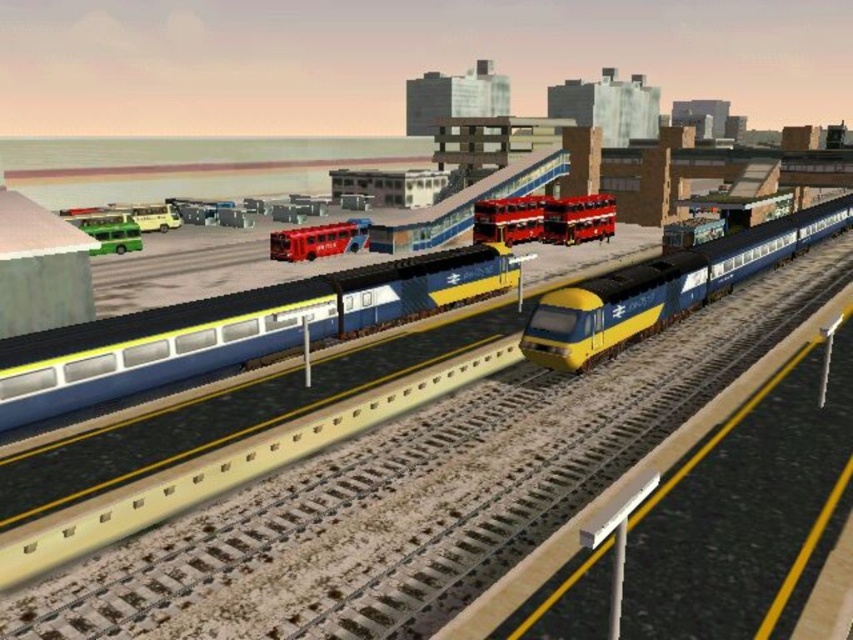
Does blue glossy train at center lie in front of red metallic bus at center?

Yes.

Is blue glossy train at center above red metallic bus at center?

Incorrect, blue glossy train at center is not positioned above red metallic bus at center.

What do you see at coordinates (231, 330) in the screenshot?
I see `blue glossy train at center` at bounding box center [231, 330].

At what (x,y) coordinates should I click in order to perform the action: click on blue glossy train at center. Please return your answer as a coordinate pair (x, y). Looking at the image, I should click on (231, 330).

How much distance is there between yellow matte passenger train at center and metallic red bus at center?

yellow matte passenger train at center and metallic red bus at center are 18.52 meters apart from each other.

What do you see at coordinates (666, 288) in the screenshot? I see `yellow matte passenger train at center` at bounding box center [666, 288].

Does point (727, 257) come in front of point (340, 221)?

That is True.

The width and height of the screenshot is (853, 640). I want to click on yellow matte passenger train at center, so click(666, 288).

Who is more forward, (129, 356) or (595, 310)?

Point (129, 356)

Can you confirm if blue glossy train at center is thinner than yellow matte passenger train at center?

Yes.

Between point (265, 326) and point (815, 212), which one is positioned behind?

The point (815, 212) is more distant.

Locate an element on the screen. Image resolution: width=853 pixels, height=640 pixels. blue glossy train at center is located at coordinates (231, 330).